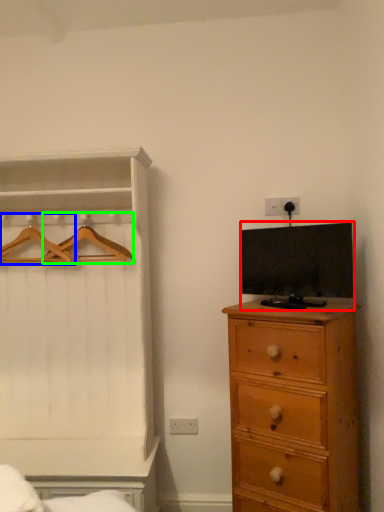
Question: Which object is positioned farthest from television (highlighted by a red box)? Select from hanger (highlighted by a blue box) and hanger (highlighted by a green box).

Choices:
 (A) hanger
 (B) hanger

Answer: (A)